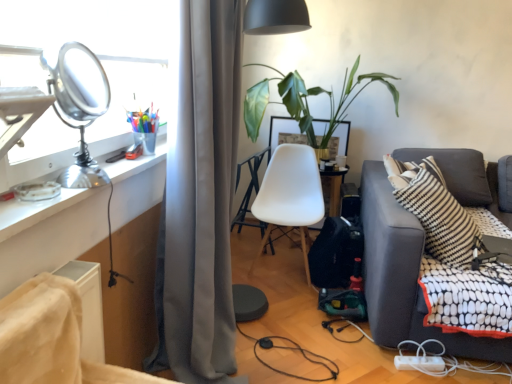
Locate an element on the screen. The image size is (512, 384). vacant region to the left of white plastic power strip at lower right is located at coordinates (379, 364).